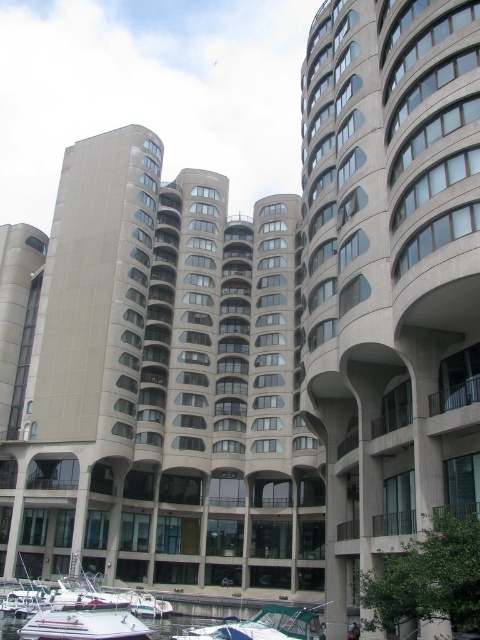
You are standing at the entrance of the gray concrete building at center. Looking at the point marked as point (155, 381), which is part of the building, can you tell me what architectural feature is located at that point?

The point (155, 381) corresponds to the gray concrete building at center, so the architectural feature at that point is part of the building itself, likely a section of its facade or structural element.

You are a visitor standing at the entrance of the modern architectural structure and see the white matte boat at lower left and the white glossy boat at lower center. Which boat is closer to you?

The white matte boat at lower left is closer to you because it is positioned over the white glossy boat at lower center, indicating it is in front.